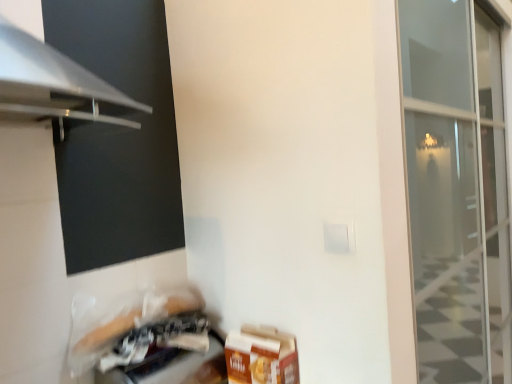
Where is `brown cardboard box at lower right`? brown cardboard box at lower right is located at coordinates (261, 356).

At what (x,y) coordinates should I click in order to perform the action: click on black matte screen at lower left. Please return your answer as a coordinate pair (x, y). Looking at the image, I should click on (117, 136).

From the picture: From the image's perspective, is plastic bag at lower left positioned above or below brown cardboard box at lower right?

plastic bag at lower left is situated lower than brown cardboard box at lower right in the image.

Who is taller, plastic bag at lower left or brown cardboard box at lower right?

brown cardboard box at lower right is taller.

Considering the positions of points (112, 377) and (238, 350), is point (112, 377) farther from camera compared to point (238, 350)?

No, it is in front of (238, 350).

Which object is further away from the camera, black matte screen at lower left or plastic bag at lower left?

plastic bag at lower left is behind.

Is black matte screen at lower left located outside plastic bag at lower left?

Absolutely, black matte screen at lower left is external to plastic bag at lower left.

From the picture: Considering the sizes of objects black matte screen at lower left and plastic bag at lower left in the image provided, who is bigger, black matte screen at lower left or plastic bag at lower left?

black matte screen at lower left.

Which object is positioned more to the right, black matte screen at lower left or plastic bag at lower left?

From the viewer's perspective, plastic bag at lower left appears more on the right side.

Can you confirm if brown cardboard box at lower right is wider than plastic bag at lower left?

In fact, brown cardboard box at lower right might be narrower than plastic bag at lower left.

You are a GUI agent. You are given a task and a screenshot of the screen. Output one action in this format:
    pyautogui.click(x=<x>, y=<y>)
    Task: Click on the appliance in front of the brown cardboard box at lower right
    This screenshot has height=384, width=512.
    Given the screenshot: What is the action you would take?
    pyautogui.click(x=156, y=348)

Is brown cardboard box at lower right turned away from plastic bag at lower left?

Absolutely, brown cardboard box at lower right is directed away from plastic bag at lower left.

At what (x,y) coordinates should I click in order to perform the action: click on window screen above the brown cardboard box at lower right (from a real-world perspective). Please return your answer as a coordinate pair (x, y). Looking at the image, I should click on click(117, 136).

Which is less distant, (77, 188) or (227, 362)?

The point (77, 188) is in front.

Considering the relative sizes of black matte screen at lower left and brown cardboard box at lower right in the image provided, is black matte screen at lower left shorter than brown cardboard box at lower right?

No, black matte screen at lower left is not shorter than brown cardboard box at lower right.

Would you say black matte screen at lower left is to the left or to the right of brown cardboard box at lower right in the picture?

In the image, black matte screen at lower left appears on the left side of brown cardboard box at lower right.

Locate an element on the screen. The height and width of the screenshot is (384, 512). window screen above the plastic bag at lower left (from a real-world perspective) is located at coordinates (117, 136).

Is plastic bag at lower left inside or outside of black matte screen at lower left?

plastic bag at lower left is not inside black matte screen at lower left, it's outside.

Who is shorter, plastic bag at lower left or black matte screen at lower left?

With less height is plastic bag at lower left.

From the picture: Does plastic bag at lower left have a larger size compared to black matte screen at lower left?

Incorrect, plastic bag at lower left is not larger than black matte screen at lower left.

Can we say brown cardboard box at lower right lies outside black matte screen at lower left?

Absolutely, brown cardboard box at lower right is external to black matte screen at lower left.

The image size is (512, 384). In the image, there is a black matte screen at lower left. What are the coordinates of `cardboard box below it (from a real-world perspective)` in the screenshot? It's located at (261, 356).

From the image's perspective, which one is positioned higher, brown cardboard box at lower right or black matte screen at lower left?

black matte screen at lower left is shown above in the image.

Locate an element on the screen. The width and height of the screenshot is (512, 384). appliance on the left side of brown cardboard box at lower right is located at coordinates (156, 348).

Image resolution: width=512 pixels, height=384 pixels. In order to click on appliance that is under the black matte screen at lower left (from a real-world perspective) in this screenshot , I will do `click(156, 348)`.

From the image, which object appears to be nearer to brown cardboard box at lower right, black matte screen at lower left or plastic bag at lower left?

plastic bag at lower left lies closer to brown cardboard box at lower right than the other object.

Estimate the real-world distances between objects in this image. Which object is further from plastic bag at lower left, black matte screen at lower left or brown cardboard box at lower right?

black matte screen at lower left is further to plastic bag at lower left.

Which object lies further to the anchor point black matte screen at lower left, plastic bag at lower left or brown cardboard box at lower right?

brown cardboard box at lower right.

Which object lies further to the anchor point black matte screen at lower left, brown cardboard box at lower right or plastic bag at lower left?

Among the two, brown cardboard box at lower right is located further to black matte screen at lower left.

When comparing their distances from plastic bag at lower left, does brown cardboard box at lower right or black matte screen at lower left seem further?

Among the two, black matte screen at lower left is located further to plastic bag at lower left.

From the image, which object appears to be farther from brown cardboard box at lower right, plastic bag at lower left or black matte screen at lower left?

The object further to brown cardboard box at lower right is black matte screen at lower left.

Locate an element on the screen. cardboard box between black matte screen at lower left and plastic bag at lower left in the vertical direction is located at coordinates (261, 356).